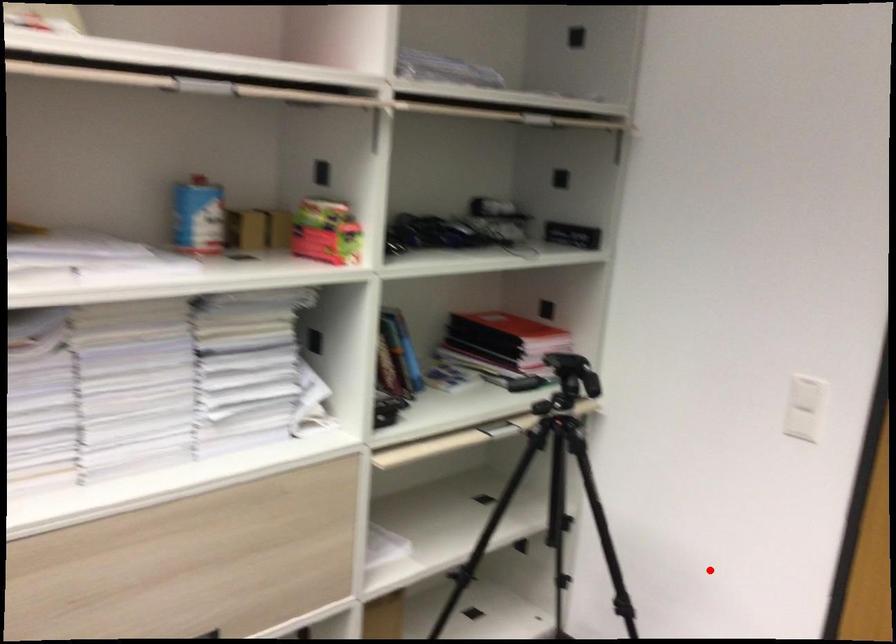
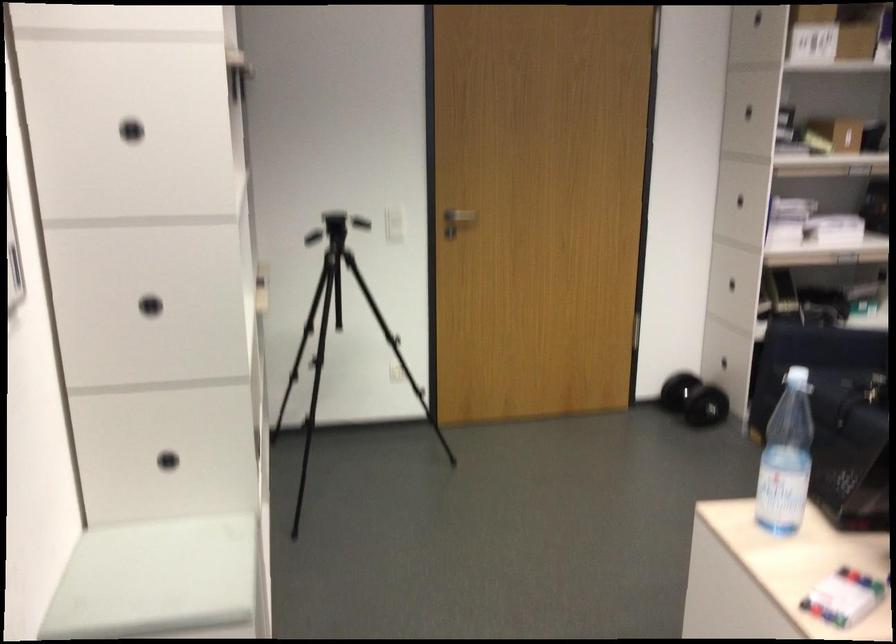
Question: I am providing you with two images of the same scene from different viewpoints. A red point is shown in image1. For the corresponding object point in image2, is it positioned nearer or farther from the camera?

Choices:
 (A) Nearer
 (B) Farther

Answer: (B)